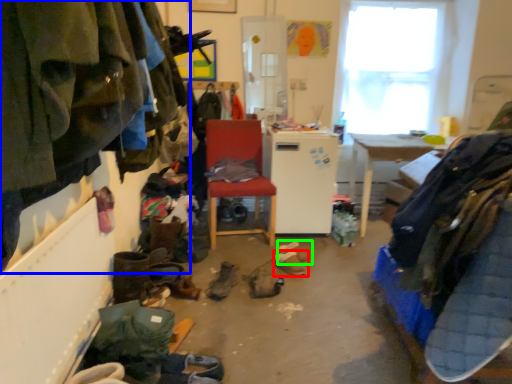
Question: Considering the real-world distances, which object is closest to footwear (highlighted by a red box)? clothing (highlighted by a blue box) or footwear (highlighted by a green box).

Choices:
 (A) clothing
 (B) footwear

Answer: (B)